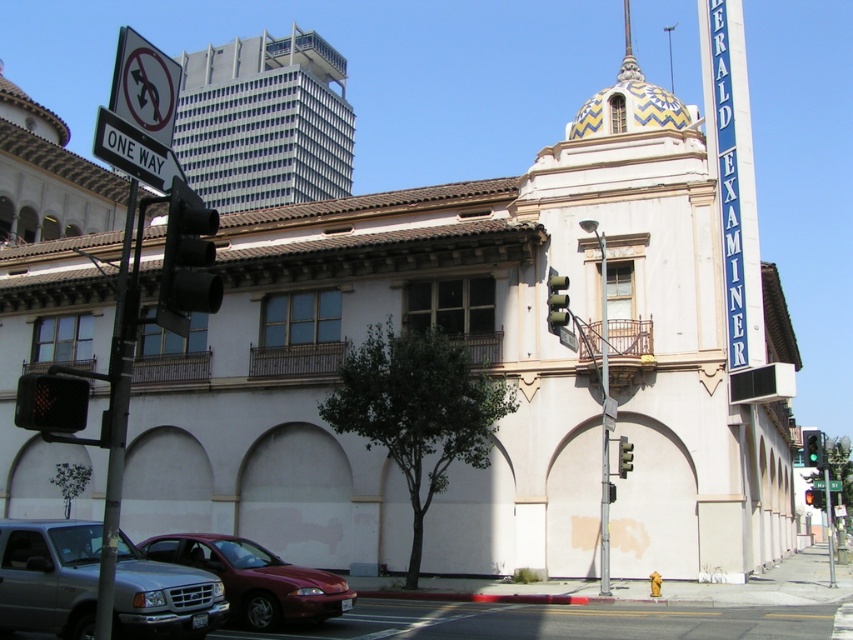
You are a delivery driver approaching the intersection and see the white plastic street sign at upper left and the green glass traffic light at center. Which object is taller?

The white plastic street sign at upper left is much taller than the green glass traffic light at center according to the description.

You are a pedestrian waiting at the intersection and see the green matte traffic light at center and the green glass traffic light at right. Which one is positioned to the left side from your perspective?

The green matte traffic light at center is positioned to the left of the green glass traffic light at right.